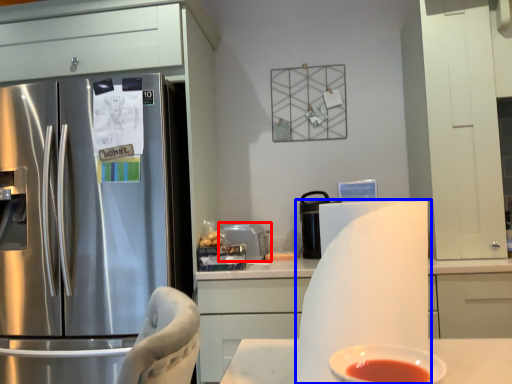
Question: Which object appears closest to the camera in this image, appliance (highlighted by a red box) or paper towel (highlighted by a blue box)?

Choices:
 (A) appliance
 (B) paper towel

Answer: (B)